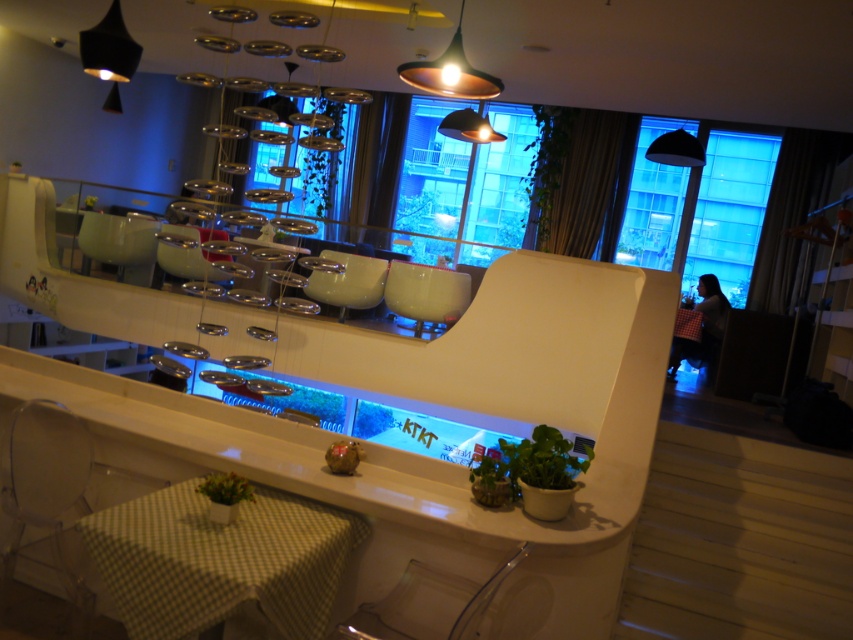
Does green checkered tablecloth at lower left appear on the left side of green matte plant at lower center?

In fact, green checkered tablecloth at lower left is to the right of green matte plant at lower center.

Who is more distant from viewer, (270, 508) or (244, 497)?

Positioned behind is point (270, 508).

Identify the location of green checkered tablecloth at lower left. (219, 561).

Does green checkered tablecloth at lower left have a larger size compared to metallic copper pendant light at upper center?

Yes, green checkered tablecloth at lower left is bigger than metallic copper pendant light at upper center.

Is point (230, 586) less distant than point (461, 116)?

That is True.

Image resolution: width=853 pixels, height=640 pixels. What do you see at coordinates (219, 561) in the screenshot?
I see `green checkered tablecloth at lower left` at bounding box center [219, 561].

Where is `green checkered tablecloth at lower left`? green checkered tablecloth at lower left is located at coordinates (219, 561).

Which is above, copper metallic pendant light at upper center or black matte lampshade at upper right?

Positioned higher is black matte lampshade at upper right.

Is point (405, 76) farther from viewer compared to point (675, 150)?

No, it is not.

Where is `copper metallic pendant light at upper center`? The image size is (853, 640). copper metallic pendant light at upper center is located at coordinates (450, 72).

Find the location of a particular element. The width and height of the screenshot is (853, 640). copper metallic pendant light at upper center is located at coordinates (450, 72).